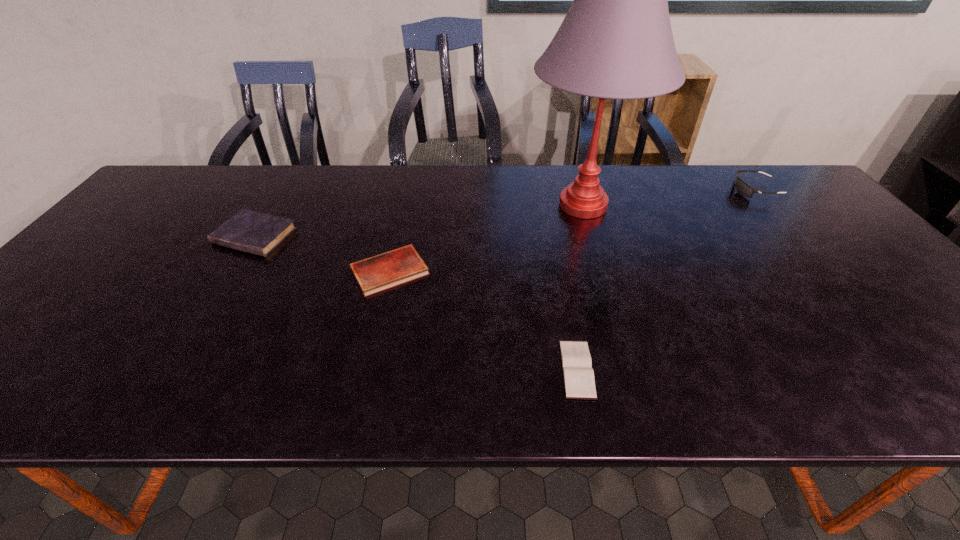
You are a GUI agent. You are given a task and a screenshot of the screen. Output one action in this format:
    pyautogui.click(x=<x>, y=<y>)
    Task: Click on the tallest object
    This screenshot has width=960, height=540.
    Given the screenshot: What is the action you would take?
    pyautogui.click(x=615, y=42)

You are a GUI agent. You are given a task and a screenshot of the screen. Output one action in this format:
    pyautogui.click(x=<x>, y=<y>)
    Task: Click on the goggles
    This screenshot has width=960, height=540.
    Given the screenshot: What is the action you would take?
    pyautogui.click(x=743, y=188)

Locate an element on the screen. the second tallest object is located at coordinates (743, 188).

The image size is (960, 540). I want to click on the leftmost object, so click(258, 233).

Where is `the leftmost diary`? Image resolution: width=960 pixels, height=540 pixels. the leftmost diary is located at coordinates 258,233.

Where is `the fourth object from right to left`? The image size is (960, 540). the fourth object from right to left is located at coordinates (375, 274).

At what (x,y) coordinates should I click in order to perform the action: click on the nearest object. Please return your answer as a coordinate pair (x, y). Image resolution: width=960 pixels, height=540 pixels. Looking at the image, I should click on (578, 375).

Locate an element on the screen. the nearest diary is located at coordinates (578, 375).

Where is `free region located on the front-facing side of the table lamp`? The height and width of the screenshot is (540, 960). free region located on the front-facing side of the table lamp is located at coordinates (507, 205).

Where is `free space located 0.380m on the front-facing side of the table lamp`? This screenshot has width=960, height=540. free space located 0.380m on the front-facing side of the table lamp is located at coordinates point(395,205).